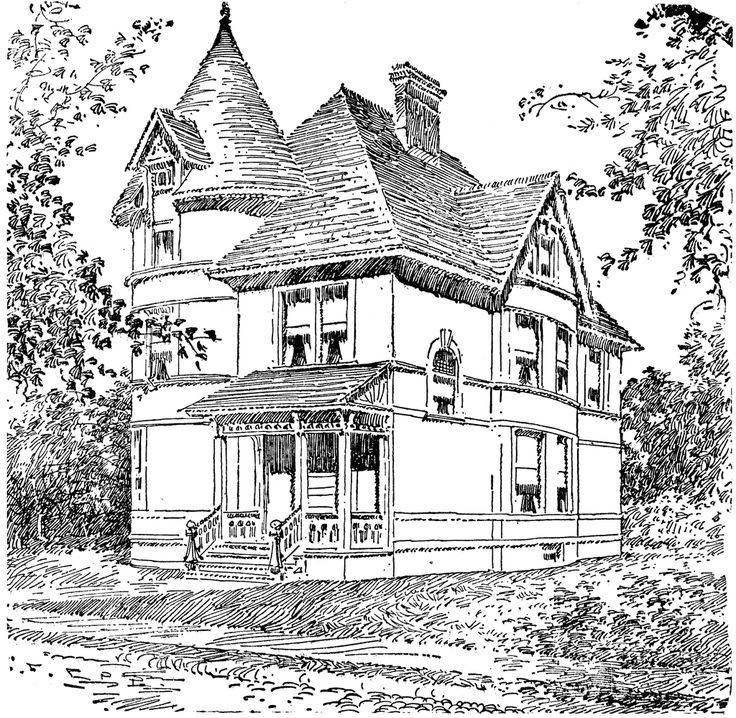
Where is `wall`? The width and height of the screenshot is (736, 718). wall is located at coordinates (436, 495).